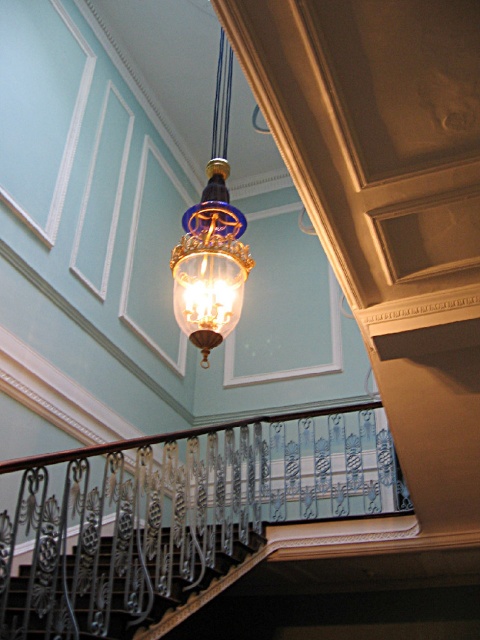
Is point (12, 508) more distant than point (8, 600)?

Yes, it is.

Is point (41, 624) closer to camera compared to point (12, 628)?

No, (41, 624) is further to viewer.

Between point (177, 492) and point (239, 544), which one is positioned in front?

Positioned in front is point (177, 492).

Locate an element on the screen. The width and height of the screenshot is (480, 640). black wrought iron railing at center is located at coordinates (175, 513).

Which is above, black wrought iron railing at center or translucent glass lamp at center?

translucent glass lamp at center is above.

What do you see at coordinates (175, 513) in the screenshot? The height and width of the screenshot is (640, 480). I see `black wrought iron railing at center` at bounding box center [175, 513].

Who is more distant from viewer, (99, 506) or (238, 289)?

The point (238, 289) is more distant.

What are the coordinates of `black wrought iron railing at center` in the screenshot? It's located at (175, 513).

Is translucent glass lamp at center positioned before black wrought iron railing at lower left?

No, it is not.

Is translucent glass lamp at center taller than black wrought iron railing at lower left?

Correct, translucent glass lamp at center is much taller as black wrought iron railing at lower left.

The image size is (480, 640). Find the location of `translucent glass lamp at center`. translucent glass lamp at center is located at coordinates (212, 237).